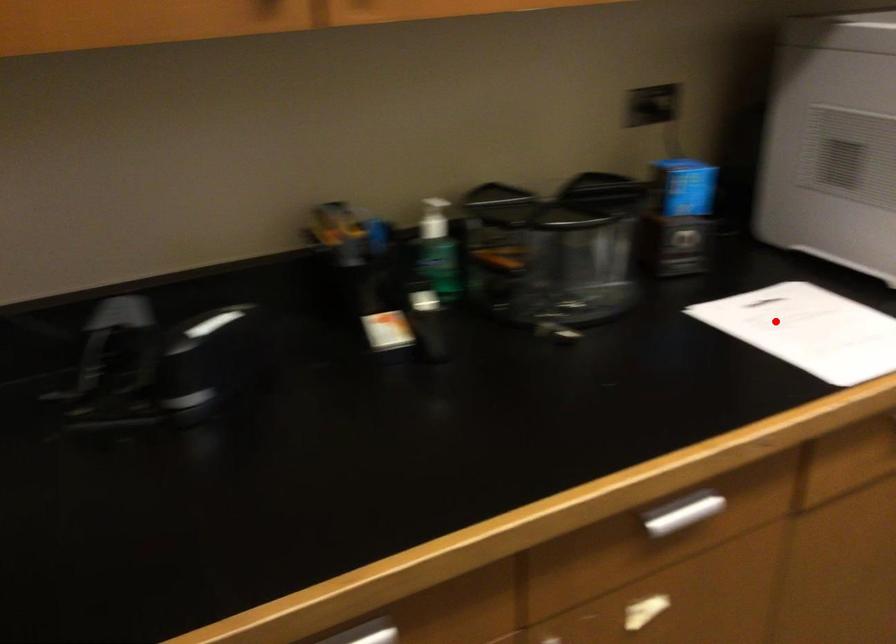
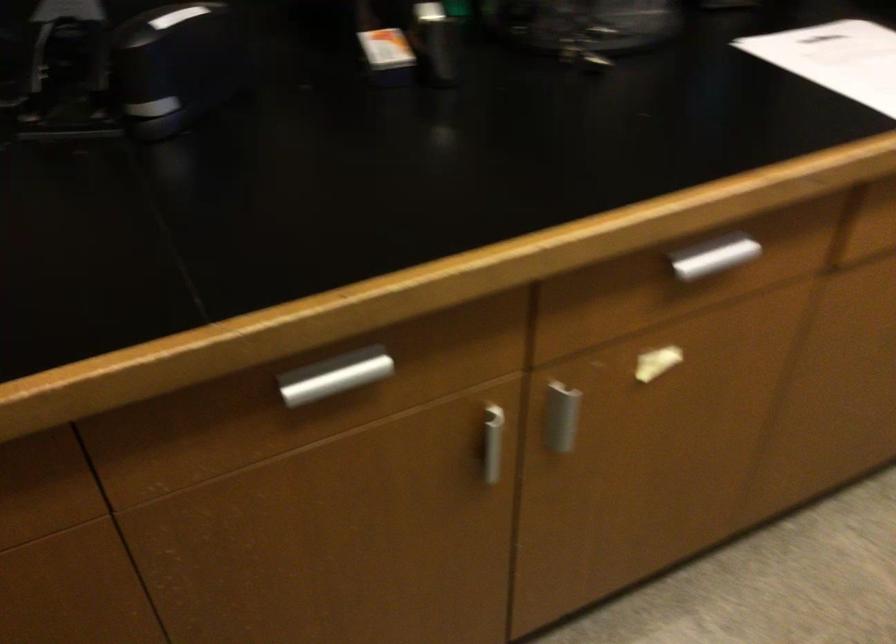
Question: I am providing you with two images of the same scene from different viewpoints. Given a red point in image1, look at the same physical point in image2. Is it:

Choices:
 (A) Closer to the viewpoint
 (B) Farther from the viewpoint

Answer: (A)